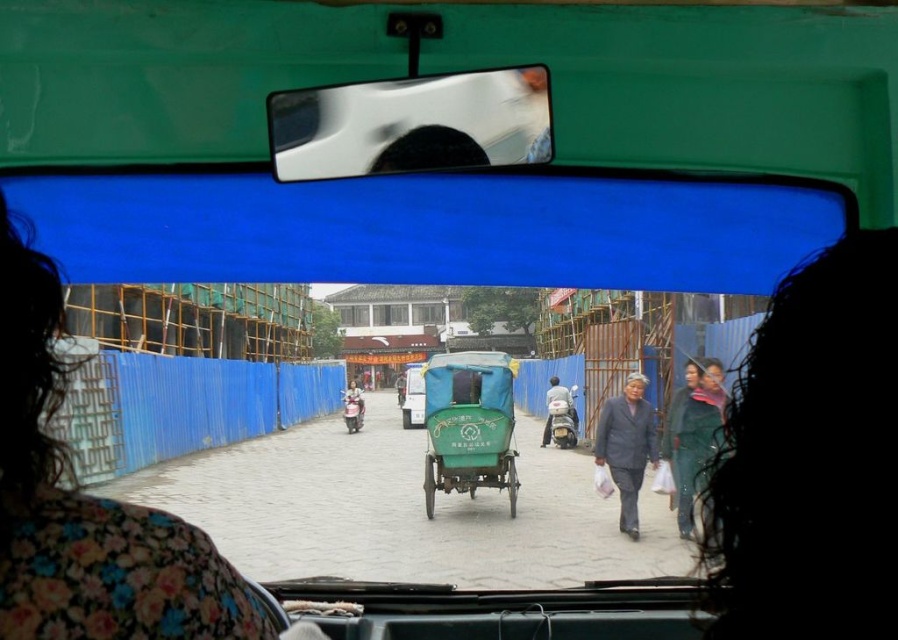
You are a passenger in the vehicle and want to check the rearview mirror to see if the green matte tricycle at center is visible in the reflection. Based on their sizes, can the shiny plastic mirror at upper center capture the entire tricycle in its reflection?

The shiny plastic mirror at upper center has a smaller size compared to green matte tricycle at center. Therefore, the mirror may not be able to capture the entire tricycle in its reflection due to its smaller size.

You are a delivery person who needs to pass by the green matte cart at center and the gray fabric coat at center on the road. Which object do you need to go around because it is taller?

The green matte cart at center is taller than the gray fabric coat at center, so you need to go around the green matte cart at center.